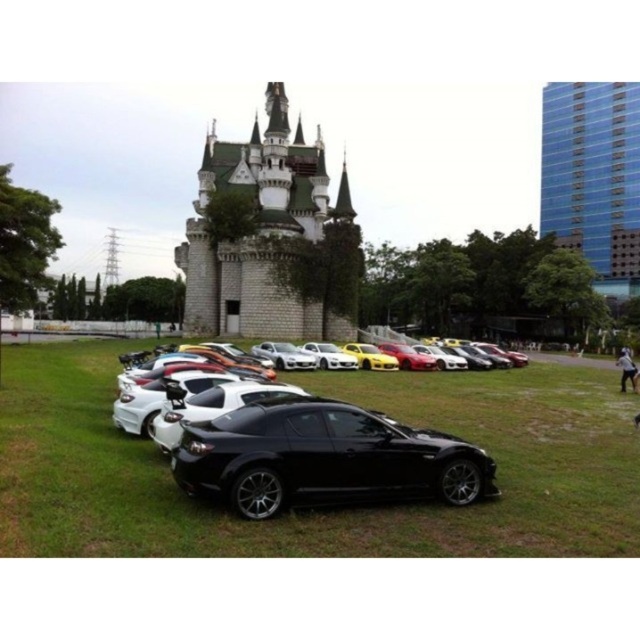
Question: Among these objects, which one is farthest from the camera?

Choices:
 (A) blue glass building at upper right
 (B) green grass at center

Answer: (A)

Question: Is blue glass building at upper right positioned at the back of white glossy sports car at center?

Choices:
 (A) no
 (B) yes

Answer: (B)

Question: Is green grass at center positioned before black matte/solid car at center?

Choices:
 (A) yes
 (B) no

Answer: (A)

Question: Is green grass at center to the left of blue glass building at upper right from the viewer's perspective?

Choices:
 (A) yes
 (B) no

Answer: (A)

Question: Which point is closer to the camera?

Choices:
 (A) green grass at center
 (B) green stone castle at center
 (C) black matte/solid car at center

Answer: (A)

Question: Which point appears farthest from the camera in this image?

Choices:
 (A) (122, 480)
 (B) (346, 244)
 (C) (540, 224)
 (D) (312, 465)

Answer: (C)